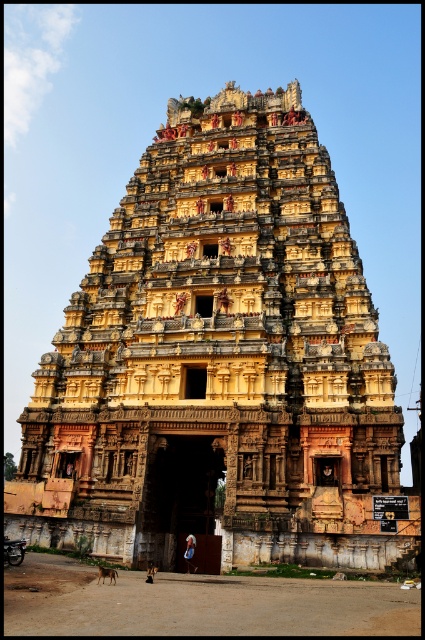
Question: Is carved stone archway at center bigger than blue fabric headscarf at center?

Choices:
 (A) no
 (B) yes

Answer: (B)

Question: Which point appears closest to the camera in this image?

Choices:
 (A) 187,545
 (B) 39,368

Answer: (A)

Question: Among these points, which one is nearest to the camera?

Choices:
 (A) (291, 486)
 (B) (150, 490)

Answer: (A)

Question: Which of the following is the closest to the observer?

Choices:
 (A) carved stone archway at center
 (B) yellow stone hindu temple at center

Answer: (B)

Question: Can you confirm if yellow stone hindu temple at center is smaller than blue fabric headscarf at center?

Choices:
 (A) no
 (B) yes

Answer: (A)

Question: Does yellow stone hindu temple at center appear on the left side of carved stone archway at center?

Choices:
 (A) yes
 (B) no

Answer: (B)